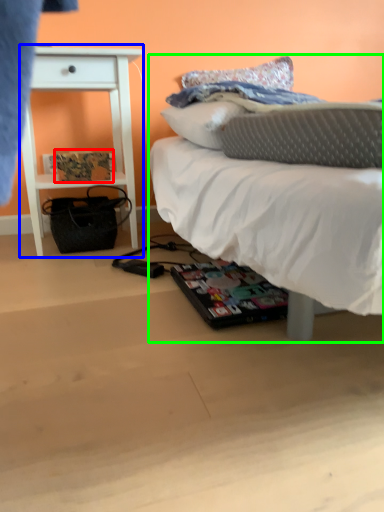
Question: Based on their relative distances, which object is nearer to magazine (highlighted by a red box)? Choose from nightstand (highlighted by a blue box) and bed (highlighted by a green box).

Choices:
 (A) nightstand
 (B) bed

Answer: (A)